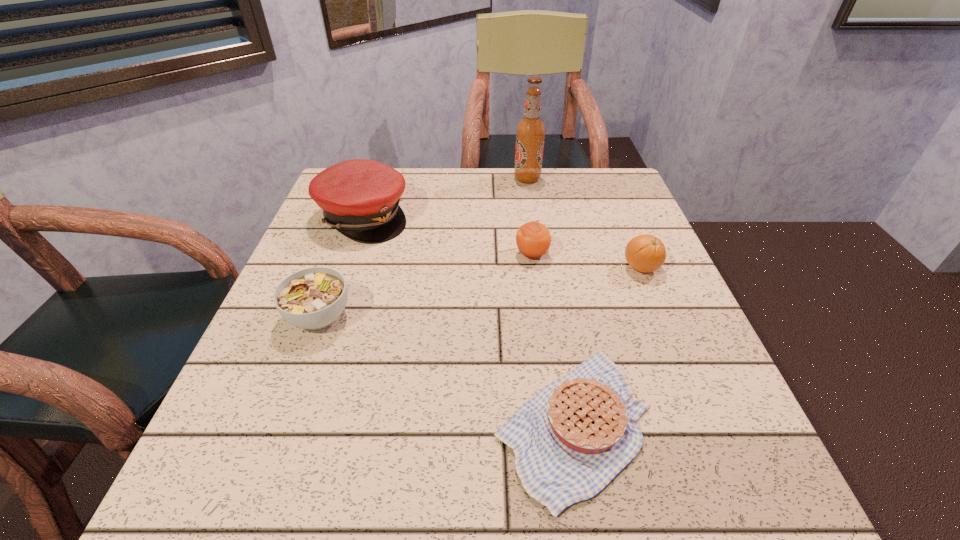
The height and width of the screenshot is (540, 960). I want to click on free space located 0.120m on the front label of the beer bottle, so click(x=470, y=179).

Identify the location of free space located 0.310m at the front of the second tallest object where the visor is located. The width and height of the screenshot is (960, 540). (533, 217).

The image size is (960, 540). I want to click on vacant area located 0.200m on the right of the left orange, so click(x=637, y=254).

The width and height of the screenshot is (960, 540). I want to click on free location located on the back of the right orange, so click(x=604, y=177).

This screenshot has height=540, width=960. Find the location of `vacant space located 0.230m on the front of the soup bowl`. vacant space located 0.230m on the front of the soup bowl is located at coordinates (264, 467).

You are a GUI agent. You are given a task and a screenshot of the screen. Output one action in this format:
    pyautogui.click(x=<x>, y=<y>)
    Task: Click on the blank area located 0.140m on the left of the pie
    The image size is (960, 540).
    Given the screenshot: What is the action you would take?
    pyautogui.click(x=403, y=424)

Locate an element on the screen. This screenshot has width=960, height=540. beer bottle present at the far edge is located at coordinates (530, 132).

Image resolution: width=960 pixels, height=540 pixels. In order to click on cap located in the far edge section of the desktop in this screenshot , I will do `click(360, 198)`.

The height and width of the screenshot is (540, 960). Identify the location of object positioned at the near edge. (576, 434).

Locate an element on the screen. cap situated at the left edge is located at coordinates (360, 198).